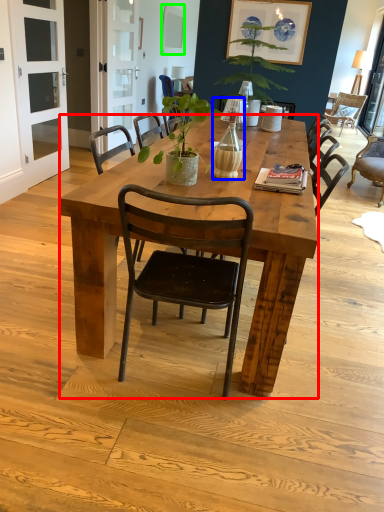
Question: Which is farther away from desk (highlighted by a red box)? bottle (highlighted by a blue box) or picture frame (highlighted by a green box)?

Choices:
 (A) bottle
 (B) picture frame

Answer: (B)